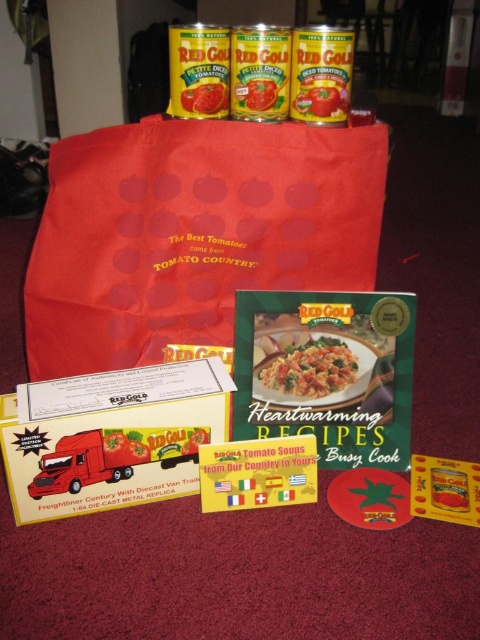
Question: Based on their relative distances, which object is nearer to the red matte paper bag at upper center?

Choices:
 (A) tomato paste can at upper center
 (B) matte green book at center

Answer: (B)

Question: Which point is closer to the camera taking this photo?

Choices:
 (A) (347, 125)
 (B) (190, 93)

Answer: (B)

Question: Does red matte paper bag at upper center have a lesser width compared to matte green book at center?

Choices:
 (A) yes
 (B) no

Answer: (B)

Question: Can you confirm if red matte paper bag at upper center is positioned below matte green book at center?

Choices:
 (A) yes
 (B) no

Answer: (B)

Question: Considering the real-world distances, which object is farthest from the matte green book at center?

Choices:
 (A) red matte paper bag at upper center
 (B) tomato paste can at upper center

Answer: (B)

Question: Can you confirm if red matte paper bag at upper center is positioned to the right of matte green book at center?

Choices:
 (A) yes
 (B) no

Answer: (B)